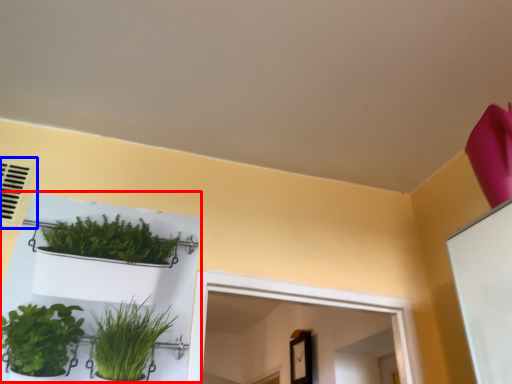
Question: Which of the following is the closest to the observer, shelf (highlighted by a red box) or air conditioning (highlighted by a blue box)?

Choices:
 (A) shelf
 (B) air conditioning

Answer: (A)